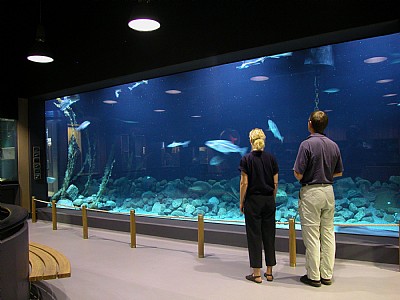
Where is `different fish swimming in an aquarium`? This screenshot has width=400, height=300. different fish swimming in an aquarium is located at coordinates (82, 125), (64, 106), (172, 144), (219, 144), (217, 158), (272, 129), (50, 178).